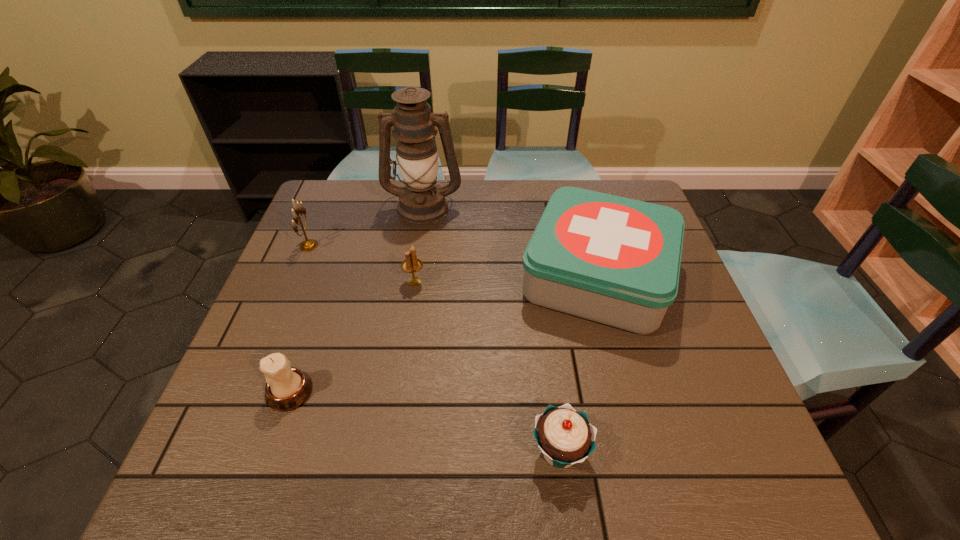
Where is `the tallest object`? Image resolution: width=960 pixels, height=540 pixels. the tallest object is located at coordinates (421, 201).

Identify the location of the farthest object. This screenshot has width=960, height=540. (421, 201).

At what (x,y) coordinates should I click in order to perform the action: click on the leftmost candle holder. Please return your answer as a coordinate pair (x, y). Looking at the image, I should click on (309, 244).

Where is `the leftmost object`? The width and height of the screenshot is (960, 540). the leftmost object is located at coordinates (309, 244).

Identify the location of the first-aid kit. (613, 260).

The image size is (960, 540). Find the location of `the rightmost candle holder`. the rightmost candle holder is located at coordinates (412, 264).

Locate an element on the screen. The image size is (960, 540). the fifth object from right to left is located at coordinates (287, 388).

Locate an element on the screen. Image resolution: width=960 pixels, height=540 pixels. the second nearest object is located at coordinates (287, 388).

Where is `the nearest object`? Image resolution: width=960 pixels, height=540 pixels. the nearest object is located at coordinates (565, 436).

At what (x,y) coordinates should I click in order to perform the action: click on vacant space situated 0.390m on the front of the oil lamp. Please return your answer as a coordinate pair (x, y). Looking at the image, I should click on (405, 326).